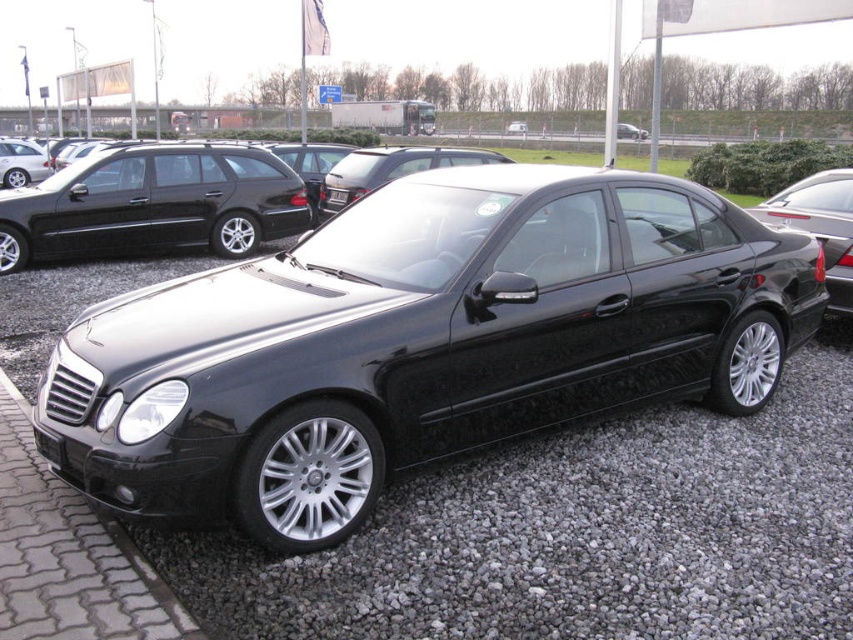
You are a photographer trying to capture both the glossy black sedan at right and the matte black sedan at center. Since you want to highlight the contrast between their finishes, you decide to position yourself so that the glossy car is on the left side of the matte one in the frame. Is this possible given their current arrangement?

Yes, the glossy black sedan at right is already positioned on the left side of the matte black sedan at center, so positioning yourself to capture this arrangement is possible.

You are standing in front of the black Mercedes Benz car parked on the gravel surface. You want to place a small marker at the point labeled point (577, 534). Based on the scene description, where exactly should you place the marker?

Place the marker at the point (577, 534) on the gray gravel at lower center.